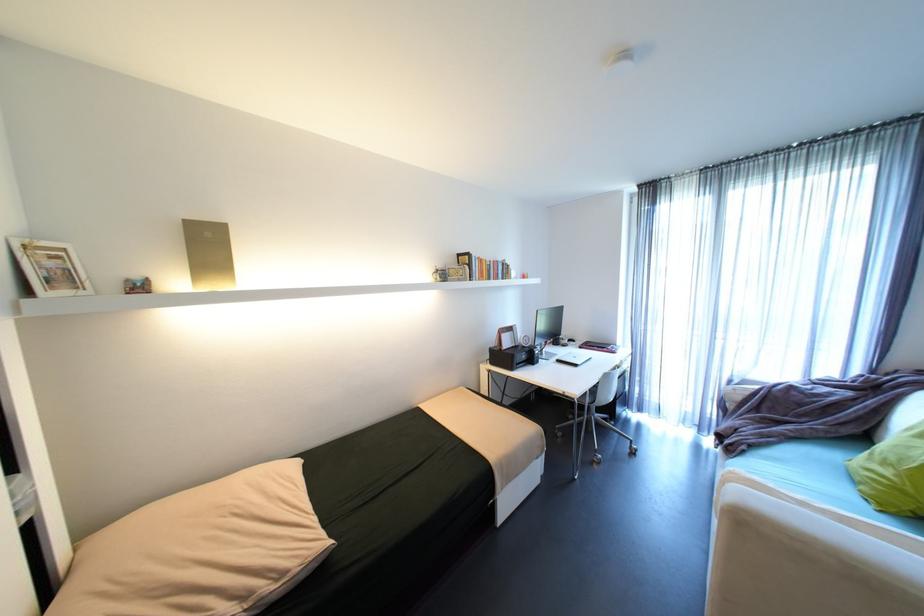
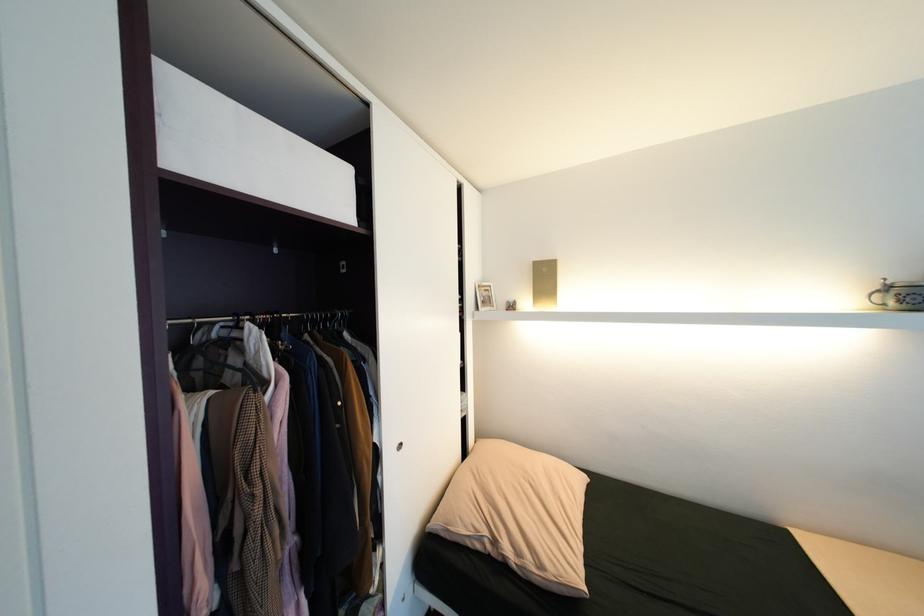
Question: How did the camera likely rotate?

Choices:
 (A) Left
 (B) Right
 (C) Up
 (D) Down

Answer: (A)